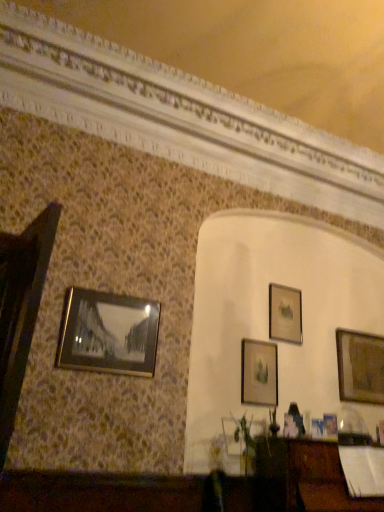
Question: Considering the positions of wooden picture frame at right, the fifth picture frame in the front-to-back sequence, and matte gold picture frame at upper right, which is the 2th picture frame in back-to-front order, in the image, is wooden picture frame at right, the fifth picture frame in the front-to-back sequence, wider or thinner than matte gold picture frame at upper right, which is the 2th picture frame in back-to-front order,?

Choices:
 (A) thin
 (B) wide

Answer: (B)

Question: Is wooden picture frame at right, the first picture frame positioned from the right, situated inside matte gold picture frame at upper right, which ranks as the third picture frame in left-to-right order, or outside?

Choices:
 (A) outside
 (B) inside

Answer: (A)

Question: Which is farther from the matte gold picture frame at upper right, the third picture frame in the right-to-left sequence?

Choices:
 (A) metallic gold picture frame at lower right, which is the 2th picture frame from front to back
 (B) matte gold picture frame at center, arranged as the 3th picture frame when viewed from the front
 (C) metallic gold picture frame at left, which ranks as the 5th picture frame in back-to-front order
 (D) wooden picture frame at right, the fifth picture frame in the front-to-back sequence

Answer: (C)

Question: Based on their relative distances, which object is farther from the matte gold picture frame at upper right, which ranks as the third picture frame in left-to-right order?

Choices:
 (A) metallic gold picture frame at left, the 1th picture frame when ordered from front to back
 (B) wooden picture frame at right, the first picture frame positioned from the right
 (C) metallic gold picture frame at lower right, which is the 2th picture frame from front to back
 (D) matte gold picture frame at center, the third picture frame from the back

Answer: (A)